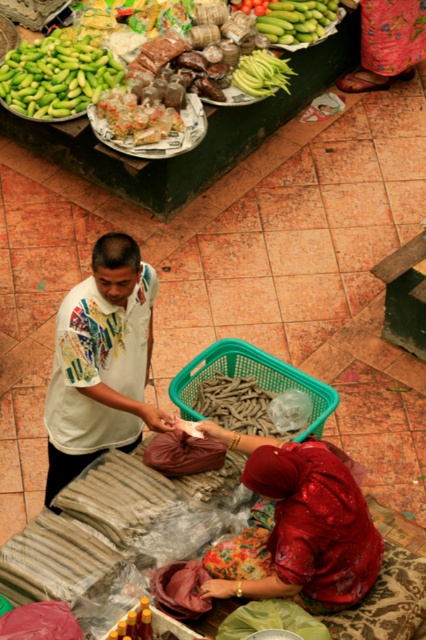
You are a customer at the market and want to buy the green matte cucumber at upper center. However, you notice the floral fabric skirt at lower right is blocking your view. Can you determine which object is taller to know if you can see the cucumber over the skirt?

The floral fabric skirt at lower right is taller than green matte cucumber at upper center, so the skirt is blocking the view of the cucumber.